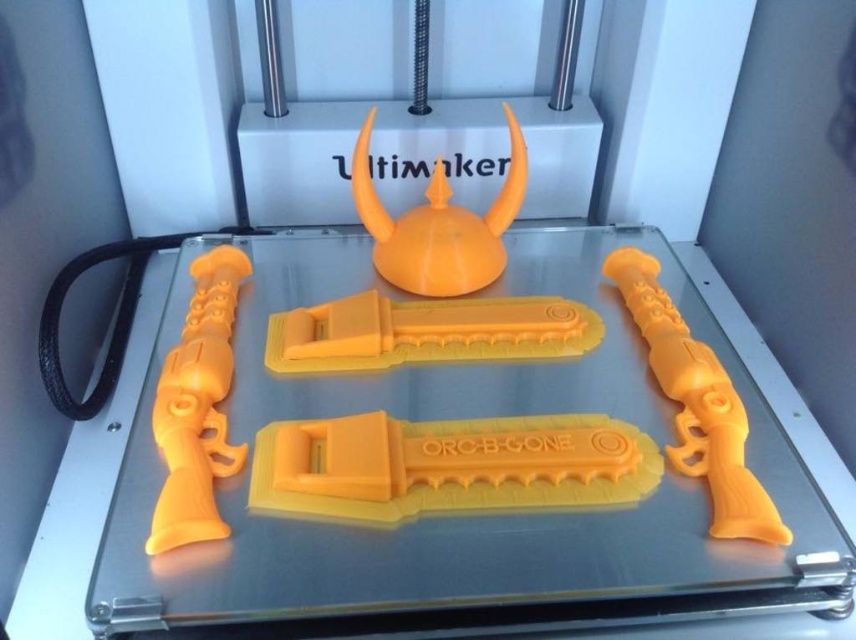
You are standing 30 inches away from the 3D printer platform. Can you safely reach the point at coordinates point (510,484) without getting too close to the printer?

The distance of point (510,484) from viewer is 31.03 inches, so you are currently 30 inches away. To safely reach the point, you would need to move 1.03 inches closer to the platform.

What is located at point (449, 465)?

A yellow matte orange plastic knife is located at point (449, 465).

In the scene shown: You are a 3D printing enthusiast who wants to place a new object on the platform. The new object is a small cube that must be placed between the yellow matte plastic sword at center and the orange matte helmet at center. Can you do this?

The yellow matte plastic sword at center is closer to the viewer than the orange matte helmet at center, so there is space between them to place the cube.